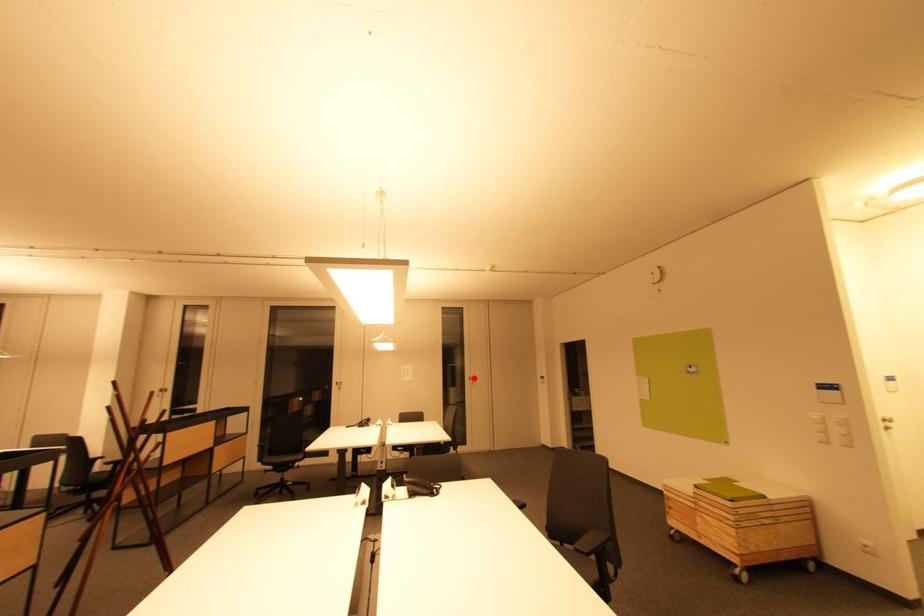
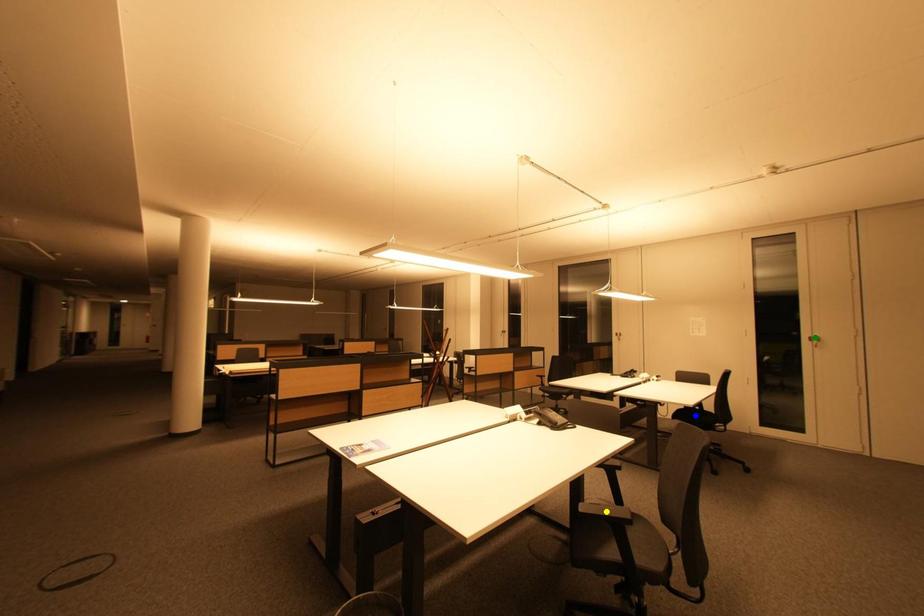
Question: I am providing you with two images of the same scene from different viewpoints. A red point is marked on the first image. You are given multiple points on the second image. In image 2, which mark is for the same physical point as the one in image 1?

Choices:
 (A) blue point
 (B) yellow point
 (C) green point

Answer: (C)